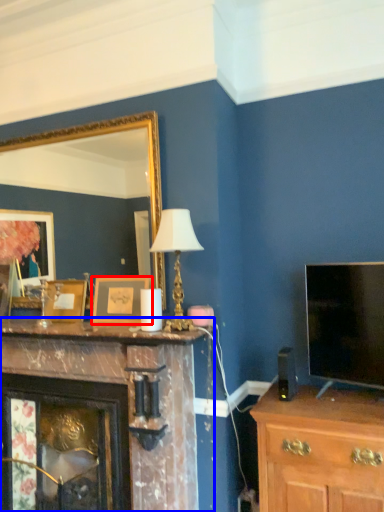
Question: Which point is closer to the camera, picture frame (highlighted by a red box) or fireplace (highlighted by a blue box)?

Choices:
 (A) picture frame
 (B) fireplace

Answer: (B)